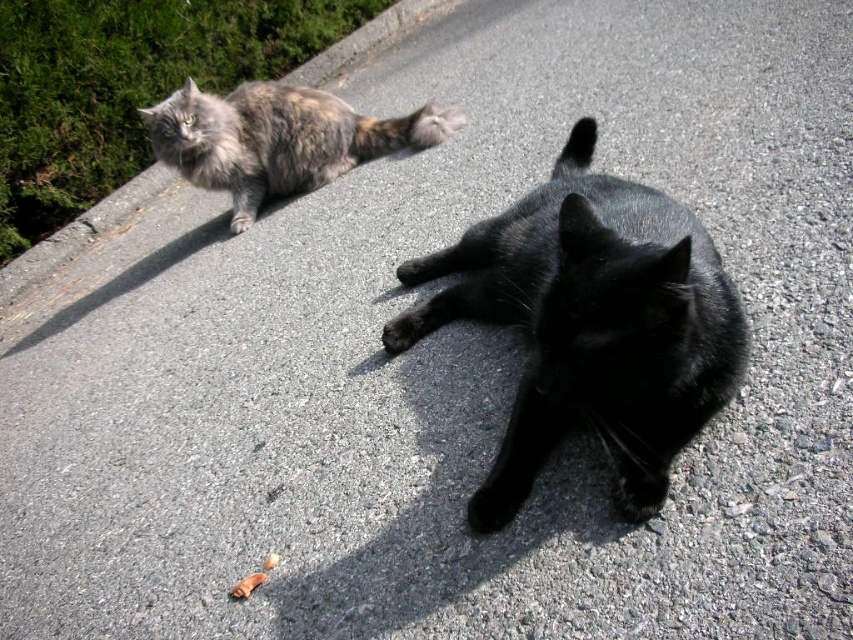
Who is more forward, (724, 355) or (165, 163)?

Positioned in front is point (724, 355).

Can you confirm if black glossy cat at center is positioned to the right of tabby fur cat at upper left?

Correct, you'll find black glossy cat at center to the right of tabby fur cat at upper left.

Which is in front, point (722, 401) or point (265, 156)?

Point (722, 401) is more forward.

Where is `black glossy cat at center`? black glossy cat at center is located at coordinates (590, 324).